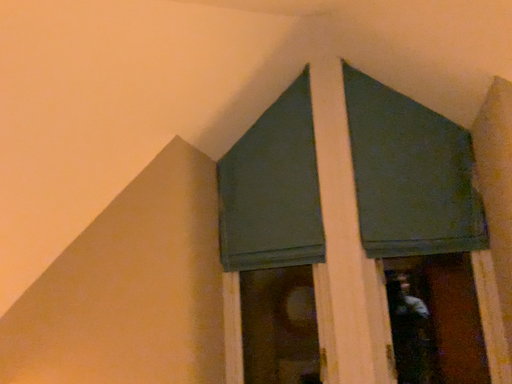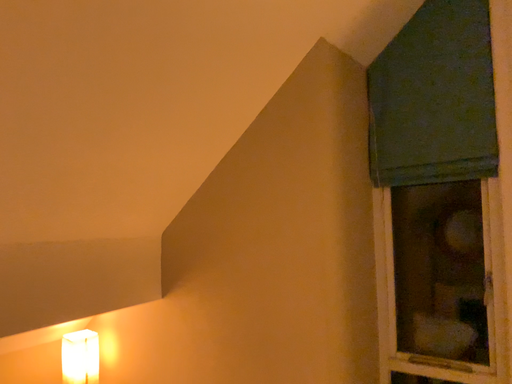
Question: How did the camera likely rotate when shooting the video?

Choices:
 (A) rotated upward
 (B) rotated downward

Answer: (B)